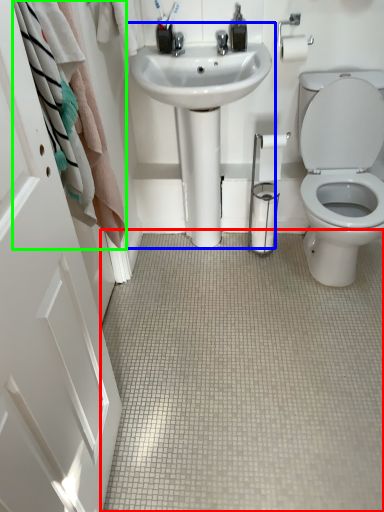
Question: Which object is positioned farthest from plain (highlighted by a red box)? Select from sink (highlighted by a blue box) and bath towel (highlighted by a green box).

Choices:
 (A) sink
 (B) bath towel

Answer: (B)